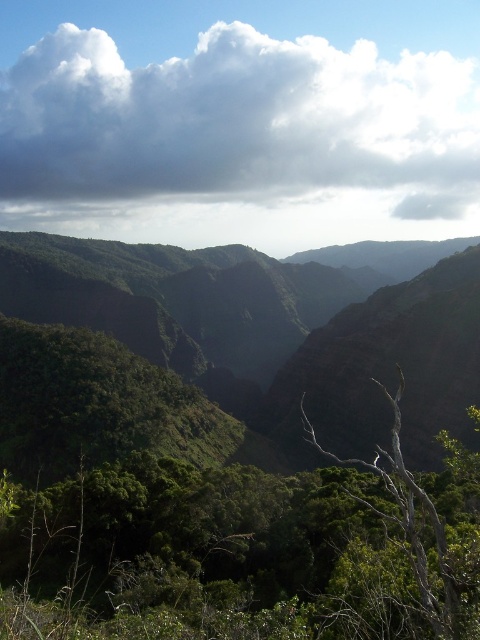
Question: Does white fluffy cloud at upper center have a lesser width compared to gray bark tree at center?

Choices:
 (A) yes
 (B) no

Answer: (B)

Question: Among these objects, which one is farthest from the camera?

Choices:
 (A) gray bark tree at center
 (B) white fluffy cloud at upper center

Answer: (B)

Question: Which point is closer to the camera taking this photo?

Choices:
 (A) coord(448,556)
 (B) coord(192,140)

Answer: (A)

Question: Which point appears farthest from the camera in this image?

Choices:
 (A) (295, 113)
 (B) (387, 518)

Answer: (A)

Question: Is white fluffy cloud at upper center below gray bark tree at center?

Choices:
 (A) no
 (B) yes

Answer: (A)

Question: Can you confirm if white fluffy cloud at upper center is positioned above gray bark tree at center?

Choices:
 (A) no
 (B) yes

Answer: (B)